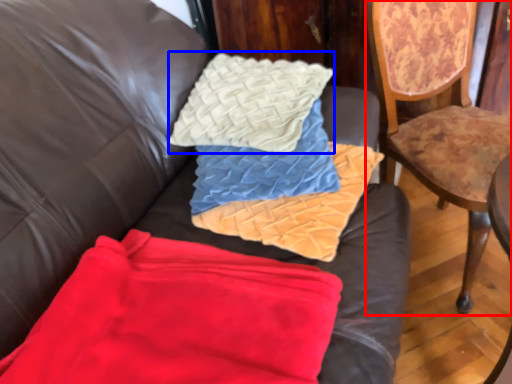
Question: Which of the following is the closest to the observer, chair (highlighted by a red box) or throw pillow (highlighted by a blue box)?

Choices:
 (A) chair
 (B) throw pillow

Answer: (A)